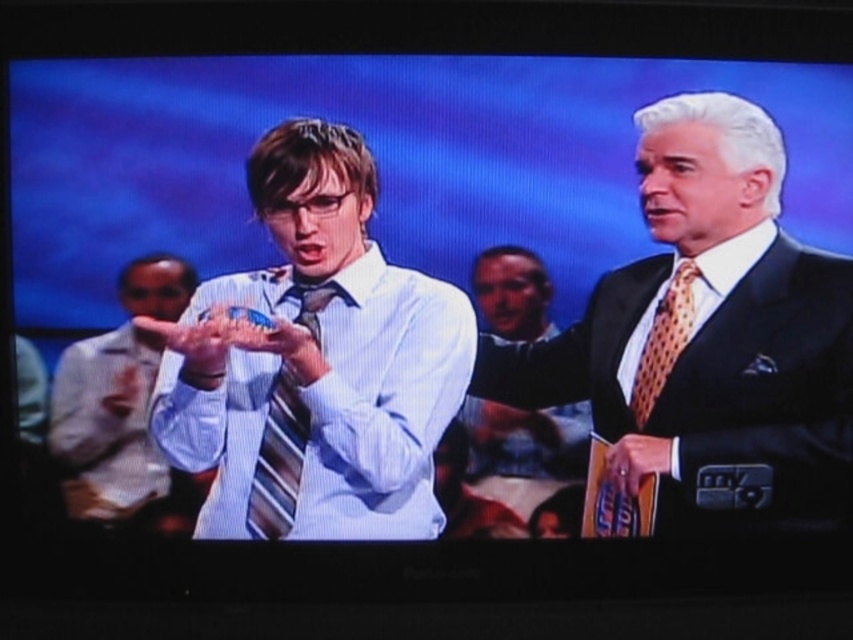
Who is more distant from viewer, [654,392] or [643,467]?

The point [643,467] is more distant.

Does orange dotted tie at right appear under white satin hand at center?

Actually, orange dotted tie at right is above white satin hand at center.

What do you see at coordinates (664, 340) in the screenshot? I see `orange dotted tie at right` at bounding box center [664, 340].

You are a GUI agent. You are given a task and a screenshot of the screen. Output one action in this format:
    pyautogui.click(x=<x>, y=<y>)
    Task: Click on the orange dotted tie at right
    This screenshot has width=853, height=640.
    Given the screenshot: What is the action you would take?
    pyautogui.click(x=664, y=340)

Between shiny black suit at right and orange dotted tie at right, which one is positioned lower?

shiny black suit at right is lower down.

The width and height of the screenshot is (853, 640). What do you see at coordinates (709, 330) in the screenshot?
I see `shiny black suit at right` at bounding box center [709, 330].

The height and width of the screenshot is (640, 853). I want to click on shiny black suit at right, so click(709, 330).

Is smooth black suit at right further to camera compared to orange dotted tie at right?

No.

Does smooth black suit at right have a larger size compared to orange dotted tie at right?

Correct, smooth black suit at right is larger in size than orange dotted tie at right.

Where is `smooth black suit at right`? This screenshot has height=640, width=853. smooth black suit at right is located at coordinates (525, 440).